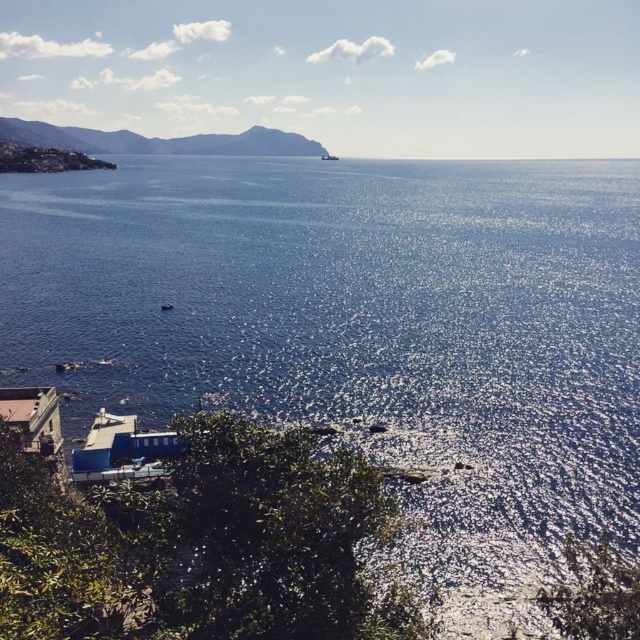
You are standing at the viewpoint on the hillside overlooking the coastal landscape. You see two points marked on the image, one at coordinates point (4, 166) and the other at point (323, 157). Which of these two points is closer to your current position?

Point (4, 166) is closer to the viewer than point (323, 157).

You are standing at the center of the image and want to walk to the matte stone shoreline at lower left. Which direction should you move?

Since the matte stone shoreline at lower left is located at point (45, 160) in the image, you should move diagonally downward and to the left from the center to reach it.

You are standing at the top of the hill overlooking the coastal landscape. You see the matte stone shoreline at lower left and the metallic silver boat at center. Which object is larger in size?

The matte stone shoreline at lower left is bigger than the metallic silver boat at center.